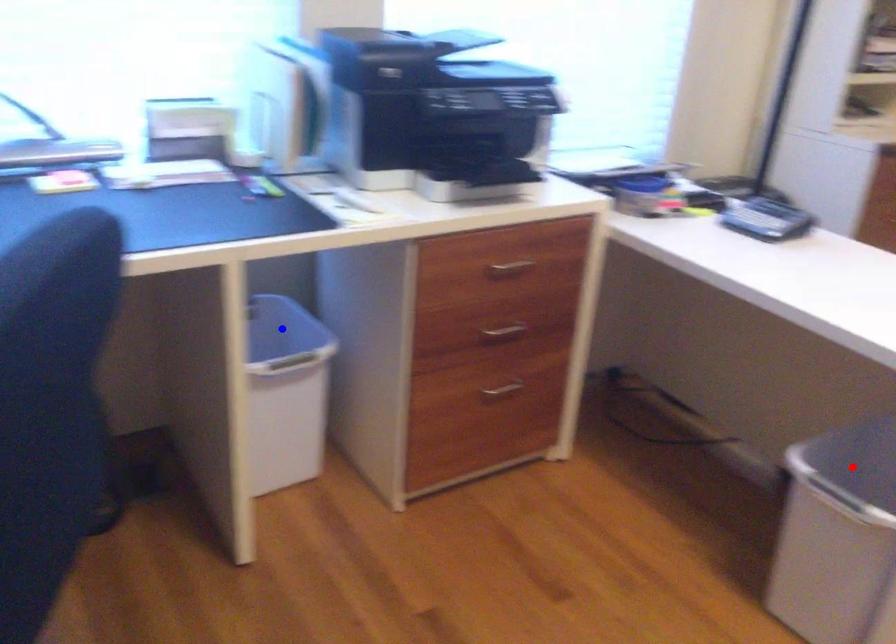
Question: In the image, two points are highlighted. Which point is nearer to the camera? Reply with the corresponding letter.

Choices:
 (A) blue point
 (B) red point

Answer: (B)